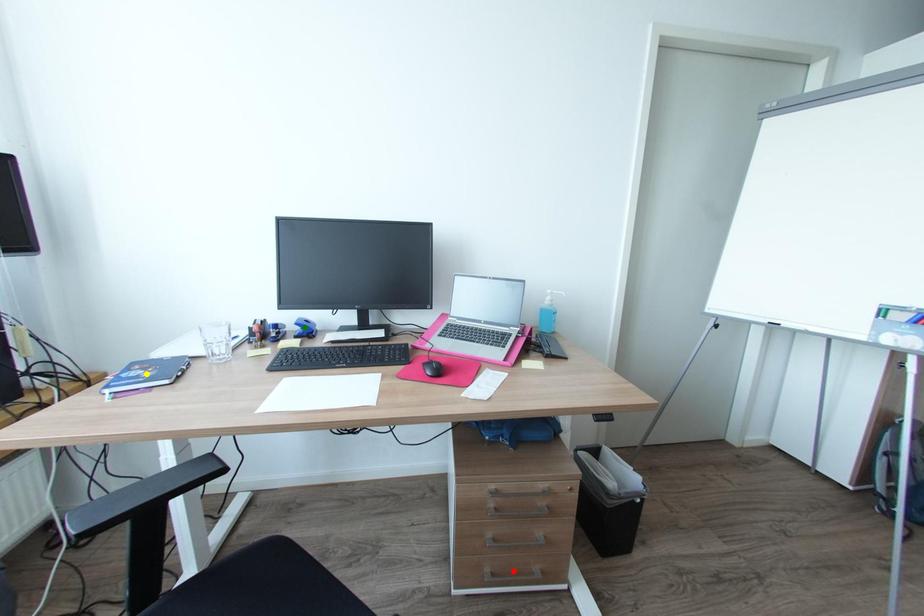
Order these from nearest to farthest:
A) red point
B) yellow point
C) green point

1. yellow point
2. red point
3. green point